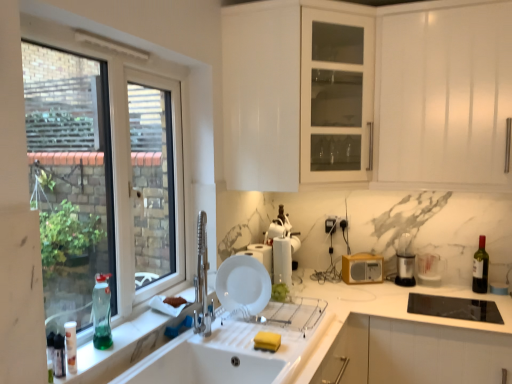
Where is `yellow plastic radio at right, the 2th appliance when ordered from right to left`? Image resolution: width=512 pixels, height=384 pixels. yellow plastic radio at right, the 2th appliance when ordered from right to left is located at coordinates (362, 268).

At what (x,y) coordinates should I click in order to perform the action: click on dark glass bottle at right, which is counted as the 1th bottle, starting from the right. Please return your answer as a coordinate pair (x, y). This screenshot has height=384, width=512. Looking at the image, I should click on (480, 268).

Image resolution: width=512 pixels, height=384 pixels. What do you see at coordinates (282, 247) in the screenshot?
I see `white glossy kettle at center, positioned as the second appliance in left-to-right order` at bounding box center [282, 247].

Locate an element on the screen. yellow plastic radio at right, the 2th appliance when ordered from right to left is located at coordinates (362, 268).

Consider the image. Is white glossy kettle at center, positioned as the second appliance in left-to-right order, a part of white matte plate at sink?

No, white glossy kettle at center, positioned as the second appliance in left-to-right order, is not surrounded by white matte plate at sink.

Looking at this image, between white matte plate at sink and white glossy kettle at center, which is the 4th appliance from right to left, which one has larger size?

white glossy kettle at center, which is the 4th appliance from right to left, is bigger.

Consider the image. Does white matte plate at sink have a greater height compared to white glossy kettle at center, which is the 4th appliance from right to left?

In fact, white matte plate at sink may be shorter than white glossy kettle at center, which is the 4th appliance from right to left.

Which object is closer to the camera taking this photo, white matte plate at sink or white glossy kettle at center, positioned as the second appliance in left-to-right order?

white matte plate at sink is more forward.

From the image's perspective, count 1st bottles downward from the white glossy kettle at center, which is the 4th appliance from right to left, and point to it. Please provide its 2D coordinates.

[(480, 268)]

Is dark glass bottle at right, which is the third bottle from left to right, located outside white glossy kettle at center, positioned as the second appliance in left-to-right order?

dark glass bottle at right, which is the third bottle from left to right, is positioned outside white glossy kettle at center, positioned as the second appliance in left-to-right order.

From a real-world perspective, which object stands above the other?

In real-world perspective, white glossy kettle at center, which is the 4th appliance from right to left, is above.

Is dark glass bottle at right, which is the third bottle from left to right, facing away from white glossy kettle at center, positioned as the second appliance in left-to-right order?

No, dark glass bottle at right, which is the third bottle from left to right, is not facing the opposite direction of white glossy kettle at center, positioned as the second appliance in left-to-right order.

From the picture: Between white plastic container at upper center, marked as the fifth appliance in a right-to-left arrangement, and white marble countertop at sink, which one has smaller width?

white plastic container at upper center, marked as the fifth appliance in a right-to-left arrangement, is thinner.

From the image's perspective, which object appears higher, white plastic container at upper center, the 1th appliance viewed from the left, or white marble countertop at sink?

white plastic container at upper center, the 1th appliance viewed from the left.

Could you tell me if white plastic container at upper center, the 1th appliance viewed from the left, is turned towards white marble countertop at sink?

No, white plastic container at upper center, the 1th appliance viewed from the left, is not oriented towards white marble countertop at sink.

From the picture: Which of these two, white plastic container at upper center, marked as the fifth appliance in a right-to-left arrangement, or white marble countertop at sink, is bigger?

white marble countertop at sink is bigger.

Looking at this image, is white plastic container at upper center, the 1th appliance viewed from the left, inside or outside of white plastic bottle at lower left, the 1th bottle from the left?

white plastic container at upper center, the 1th appliance viewed from the left, lies outside white plastic bottle at lower left, the 1th bottle from the left.

Find the location of a particular element. This screenshot has height=384, width=512. bottle that is the 3rd object located below the white plastic container at upper center, marked as the fifth appliance in a right-to-left arrangement (from the image's perspective) is located at coordinates (71, 346).

Which point is more forward, (278, 233) or (69, 337)?

The point (69, 337) is closer to the camera.

Considering the relative positions of yellow plastic radio at right, the 2th appliance when ordered from right to left, and black plastic trash can at right, the 5th appliance when ordered from left to right, in the image provided, is yellow plastic radio at right, the 2th appliance when ordered from right to left, to the left of black plastic trash can at right, the 5th appliance when ordered from left to right, from the viewer's perspective?

Indeed, yellow plastic radio at right, the 2th appliance when ordered from right to left, is positioned on the left side of black plastic trash can at right, the 5th appliance when ordered from left to right.

From the image's perspective, which object appears higher, yellow plastic radio at right, the 2th appliance when ordered from right to left, or black plastic trash can at right, the 5th appliance when ordered from left to right?

black plastic trash can at right, the 5th appliance when ordered from left to right.

This screenshot has width=512, height=384. In order to click on the 2nd appliance in front of the yellow plastic radio at right, the 2th appliance when ordered from right to left, starting your count from the anchor in this screenshot , I will do [x=405, y=270].

Based on the photo, who is smaller, yellow plastic radio at right, marked as the 4th appliance in a left-to-right arrangement, or black plastic trash can at right, the 5th appliance when ordered from left to right?

yellow plastic radio at right, marked as the 4th appliance in a left-to-right arrangement, is smaller.

Is yellow plastic radio at right, marked as the 4th appliance in a left-to-right arrangement, inside the boundaries of white ceramic sink at lower center, or outside?

yellow plastic radio at right, marked as the 4th appliance in a left-to-right arrangement, is outside white ceramic sink at lower center.

Is yellow plastic radio at right, the 2th appliance when ordered from right to left, not close to white ceramic sink at lower center?

Indeed, yellow plastic radio at right, the 2th appliance when ordered from right to left, is not near white ceramic sink at lower center.

Considering the sizes of objects yellow plastic radio at right, marked as the 4th appliance in a left-to-right arrangement, and white ceramic sink at lower center in the image provided, who is thinner, yellow plastic radio at right, marked as the 4th appliance in a left-to-right arrangement, or white ceramic sink at lower center?

yellow plastic radio at right, marked as the 4th appliance in a left-to-right arrangement, is thinner.

What are the coordinates of `the 4th appliance behind when counting from the white ceramic sink at lower center` in the screenshot? It's located at (362, 268).

Considering the sizes of objects yellow plastic radio at right, the 2th appliance when ordered from right to left, and white marble countertop at sink in the image provided, who is bigger, yellow plastic radio at right, the 2th appliance when ordered from right to left, or white marble countertop at sink?

Bigger between the two is white marble countertop at sink.

Identify the location of the 4th appliance behind the white marble countertop at sink. (362, 268).

How many degrees apart are the facing directions of yellow plastic radio at right, marked as the 4th appliance in a left-to-right arrangement, and white marble countertop at sink?

yellow plastic radio at right, marked as the 4th appliance in a left-to-right arrangement, and white marble countertop at sink are facing 57.3 degrees away from each other.

Between point (358, 259) and point (87, 372), which one is positioned in front?

The point (87, 372) is more forward.

Which appliance is the 2nd one when counting from the right side of the white matte plate at sink? Please provide its 2D coordinates.

[(282, 247)]

The width and height of the screenshot is (512, 384). There is a dark glass bottle at right, the 3th bottle in the front-to-back sequence. What are the coordinates of `the 1st appliance above it (from the image's perspective)` in the screenshot? It's located at (282, 247).

Looking at the image, which one is located further to white plastic container at upper center, the 1th appliance viewed from the left, white matte plate at sink or dark glass bottle at right, which is the first bottle from back to front?

dark glass bottle at right, which is the first bottle from back to front, is further to white plastic container at upper center, the 1th appliance viewed from the left.

Based on the photo, from the image, which object appears to be nearer to white glossy cabinet at upper center, white plastic window at left or white plastic bottle at lower left, the 1th bottle from the left?

Based on the image, white plastic bottle at lower left, the 1th bottle from the left, appears to be nearer to white glossy cabinet at upper center.

From the image, which object appears to be nearer to white matte plate at sink, white plastic paper towel holder at center, the third appliance in the left-to-right sequence, or white plastic bottle at lower left, the 1th bottle from the left?

white plastic paper towel holder at center, the third appliance in the left-to-right sequence.

Considering their positions, is white plastic bottle at lower left, which ranks as the third bottle in back-to-front order, positioned further to white glossy kettle at center, which is the 4th appliance from right to left, than white plastic container at upper center, marked as the fifth appliance in a right-to-left arrangement?

The object further to white glossy kettle at center, which is the 4th appliance from right to left, is white plastic bottle at lower left, which ranks as the third bottle in back-to-front order.

Considering their positions, is yellow plastic radio at right, the 2th appliance when ordered from right to left, positioned further to white ceramic sink at lower center than white marble countertop at sink?

yellow plastic radio at right, the 2th appliance when ordered from right to left, lies further to white ceramic sink at lower center than the other object.

From the image, which object appears to be nearer to white plastic bottle at lower left, which ranks as the third bottle in back-to-front order, white glossy cabinet at upper center or black plastic trash can at right, marked as the 1th appliance in a right-to-left arrangement?

white glossy cabinet at upper center is closer to white plastic bottle at lower left, which ranks as the third bottle in back-to-front order.

Based on their spatial positions, is dark glass bottle at right, which is the first bottle from back to front, or green glass bottle at window, the 2th bottle viewed from the back, closer to white plastic paper towel holder at center, the third appliance when ordered from right to left?

green glass bottle at window, the 2th bottle viewed from the back, lies closer to white plastic paper towel holder at center, the third appliance when ordered from right to left, than the other object.

Based on their spatial positions, is yellow plastic radio at right, the 2th appliance when ordered from right to left, or white plastic window at left further from dark glass bottle at right, which is the third bottle from left to right?

The object further to dark glass bottle at right, which is the third bottle from left to right, is white plastic window at left.

The width and height of the screenshot is (512, 384). I want to click on window located between white marble countertop at sink and yellow plastic radio at right, marked as the 4th appliance in a left-to-right arrangement, in the depth direction, so click(111, 174).

Locate an element on the screen. Image resolution: width=512 pixels, height=384 pixels. plate between white plastic window at left and white marble countertop at sink in the up-down direction is located at coordinates (243, 285).

Find the location of a particular element. plate between white plastic window at left and white plastic paper towel holder at center, the third appliance when ordered from right to left, from front to back is located at coordinates (243, 285).

You are a GUI agent. You are given a task and a screenshot of the screen. Output one action in this format:
    pyautogui.click(x=<x>, y=<y>)
    Task: Click on the window situated between green glass bottle at window, placed as the 2th bottle when sorted from left to right, and dark glass bottle at right, which is the third bottle from left to right, from left to right
    The width and height of the screenshot is (512, 384).
    Given the screenshot: What is the action you would take?
    pyautogui.click(x=111, y=174)